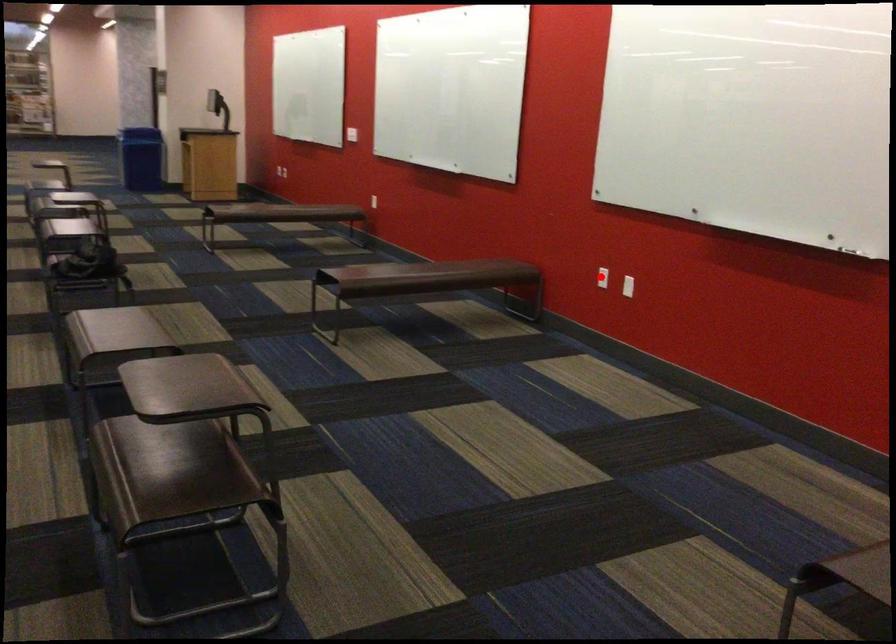
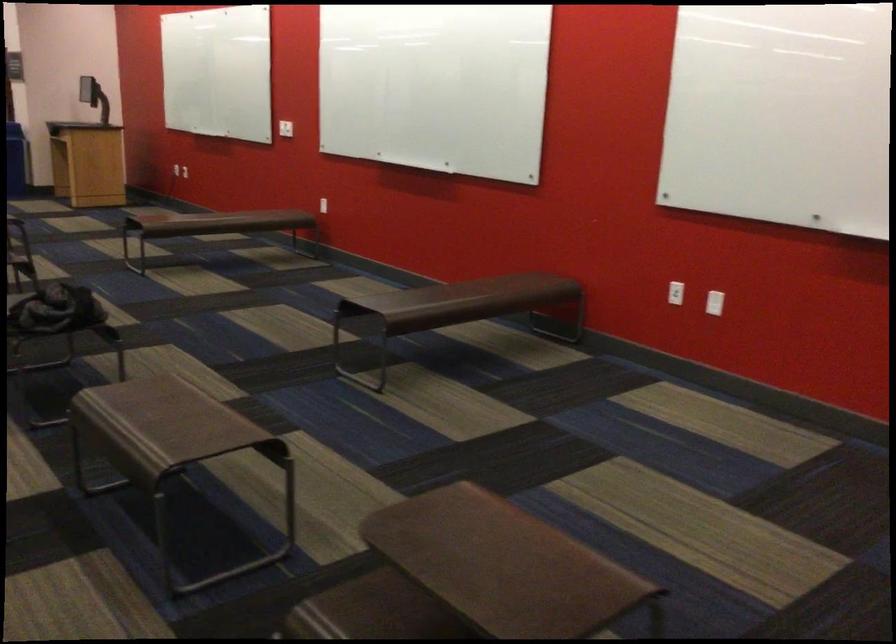
Question: I am providing you with two images of the same scene from different viewpoints. Image1 has a red point marked. In image2, the corresponding 3D location appears at what relative position? Reply with the corresponding letter.

Choices:
 (A) Closer
 (B) Farther

Answer: (A)